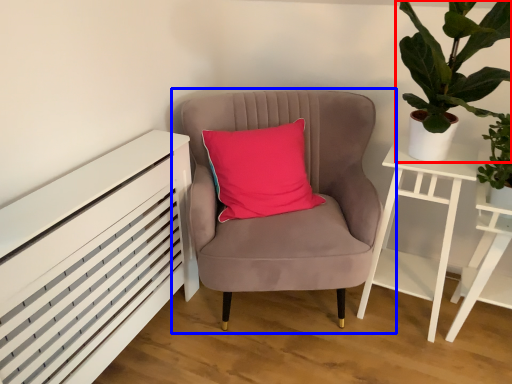
Question: Which point is closer to the camera, houseplant (highlighted by a red box) or chair (highlighted by a blue box)?

Choices:
 (A) houseplant
 (B) chair

Answer: (A)